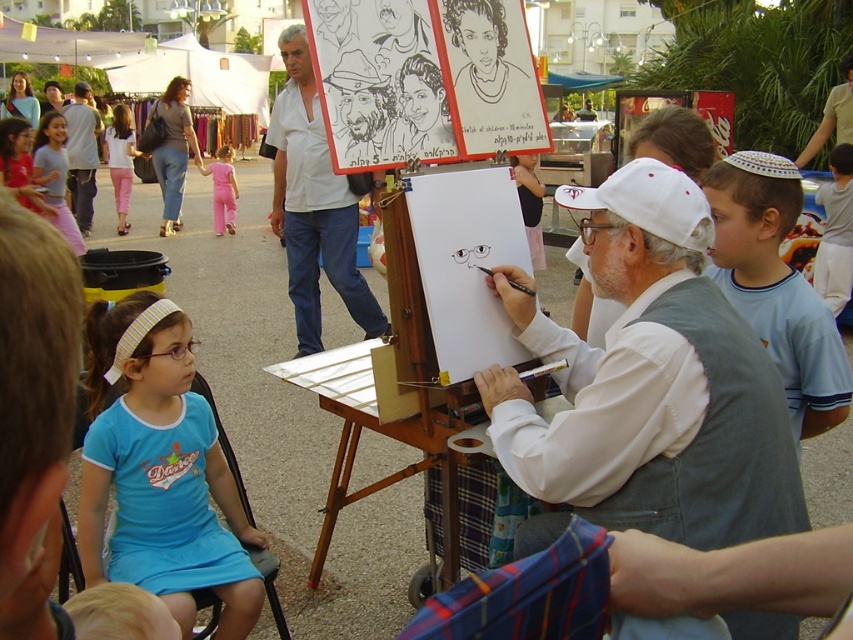
Looking at this image, you are a photographer at the event and want to capture a photo of both the white fabric vest at center and the wooden easel at center in the same frame. Based on their heights, which object will appear shorter in the photo?

The white fabric vest at center will appear shorter in the photo because it is not as tall as the wooden easel at center.

You are a photographer at the event and want to capture a photo of the white fabric vest at center and the wooden easel at center. Which object should you focus on first if you want to include both in your frame without zooming in or out?

The white fabric vest at center is smaller than the wooden easel at center, so you should focus on the wooden easel at center first to ensure it fits properly in the frame before adjusting for the smaller vest.